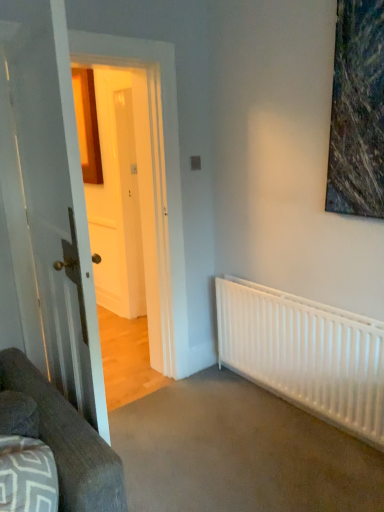
Question: Does dark gray fabric couch at lower left have a smaller size compared to white matte radiator at lower right?

Choices:
 (A) no
 (B) yes

Answer: (B)

Question: Is white matte radiator at lower right inside dark gray fabric couch at lower left?

Choices:
 (A) no
 (B) yes

Answer: (A)

Question: Is dark gray fabric couch at lower left next to white matte radiator at lower right?

Choices:
 (A) yes
 (B) no

Answer: (B)

Question: From the image's perspective, is dark gray fabric couch at lower left under white matte radiator at lower right?

Choices:
 (A) yes
 (B) no

Answer: (A)

Question: Does dark gray fabric couch at lower left appear on the left side of white matte radiator at lower right?

Choices:
 (A) no
 (B) yes

Answer: (B)

Question: Considering the positions of point (61, 433) and point (319, 333), is point (61, 433) closer or farther from the camera than point (319, 333)?

Choices:
 (A) closer
 (B) farther

Answer: (A)

Question: Which is correct: dark gray fabric couch at lower left is inside white matte radiator at lower right, or outside of it?

Choices:
 (A) outside
 (B) inside

Answer: (A)

Question: From the image's perspective, is dark gray fabric couch at lower left positioned above or below white matte radiator at lower right?

Choices:
 (A) above
 (B) below

Answer: (B)

Question: Visually, is dark gray fabric couch at lower left positioned to the left or to the right of white matte radiator at lower right?

Choices:
 (A) right
 (B) left

Answer: (B)

Question: Considering their positions, is white matte radiator at lower right located in front of or behind dark gray fabric couch at lower left?

Choices:
 (A) behind
 (B) front

Answer: (A)

Question: From a real-world perspective, relative to dark gray fabric couch at lower left, is white matte radiator at lower right vertically above or below?

Choices:
 (A) above
 (B) below

Answer: (B)

Question: Is point (284, 353) positioned closer to the camera than point (104, 450)?

Choices:
 (A) farther
 (B) closer

Answer: (A)

Question: Is white matte radiator at lower right inside the boundaries of dark gray fabric couch at lower left, or outside?

Choices:
 (A) outside
 (B) inside

Answer: (A)

Question: Looking at their shapes, would you say white glossy door at left is wider or thinner than dark gray fabric couch at lower left?

Choices:
 (A) wide
 (B) thin

Answer: (B)

Question: Is white glossy door at left to the left or to the right of dark gray fabric couch at lower left in the image?

Choices:
 (A) left
 (B) right

Answer: (A)